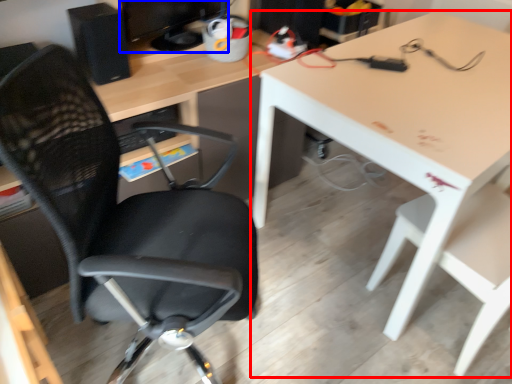
Question: Which of the following is the closest to the observer, table (highlighted by a red box) or computer monitor (highlighted by a blue box)?

Choices:
 (A) table
 (B) computer monitor

Answer: (A)